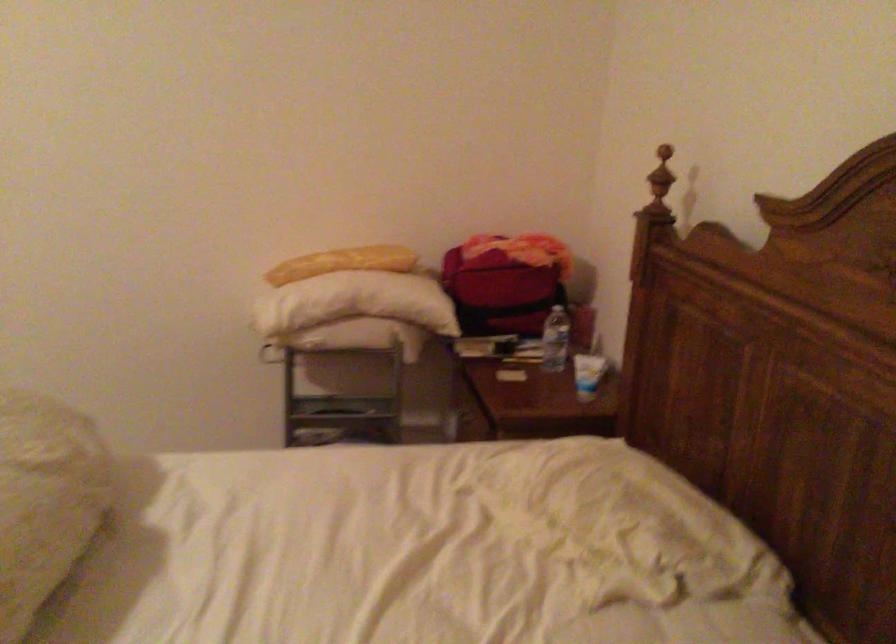
Where would you lift the long yellow bread? Please return your answer as a coordinate pair (x, y).

(342, 263)